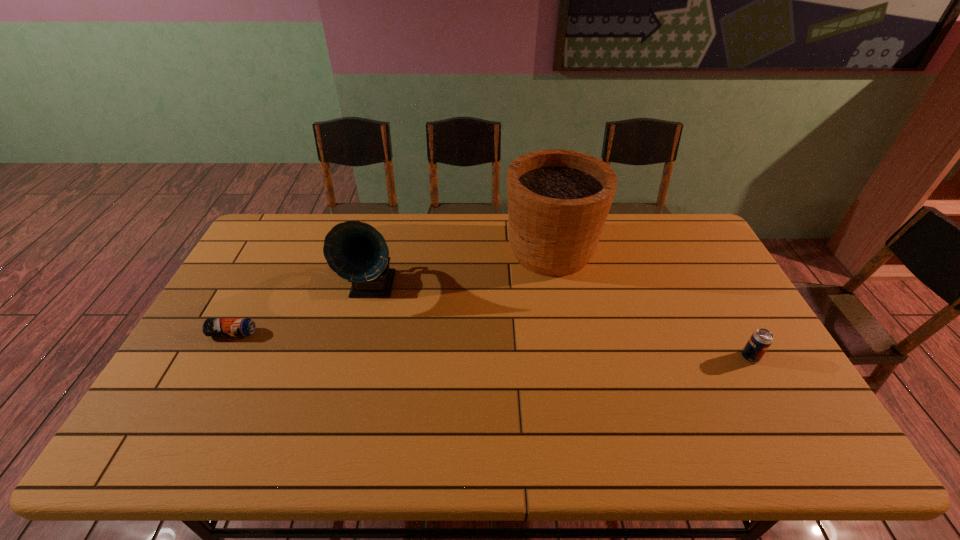
The width and height of the screenshot is (960, 540). I want to click on object located in the far edge section of the desktop, so click(x=558, y=200).

Find the location of a particular element. object present at the left edge is located at coordinates (212, 326).

This screenshot has height=540, width=960. Identify the location of object that is at the right edge. (761, 339).

You are a GUI agent. You are given a task and a screenshot of the screen. Output one action in this format:
    pyautogui.click(x=<x>, y=<y>)
    Task: Click on the vacant area at the far edge
    The height and width of the screenshot is (540, 960).
    Given the screenshot: What is the action you would take?
    pyautogui.click(x=641, y=224)

In the image, there is a desktop. Identify the location of free space at the left edge. (214, 372).

Identify the location of free space at the right edge. Image resolution: width=960 pixels, height=540 pixels. (740, 320).

This screenshot has width=960, height=540. I want to click on vacant point at the far left corner, so click(x=298, y=218).

Find the location of a particular element. The height and width of the screenshot is (540, 960). free area in between the phonograph_record and the second shortest object is located at coordinates (562, 322).

This screenshot has height=540, width=960. What are the coordinates of `blank region between the shorter beer can and the rightmost object` in the screenshot? It's located at (492, 345).

This screenshot has width=960, height=540. I want to click on vacant space that's between the right beer can and the second object from right to left, so 651,304.